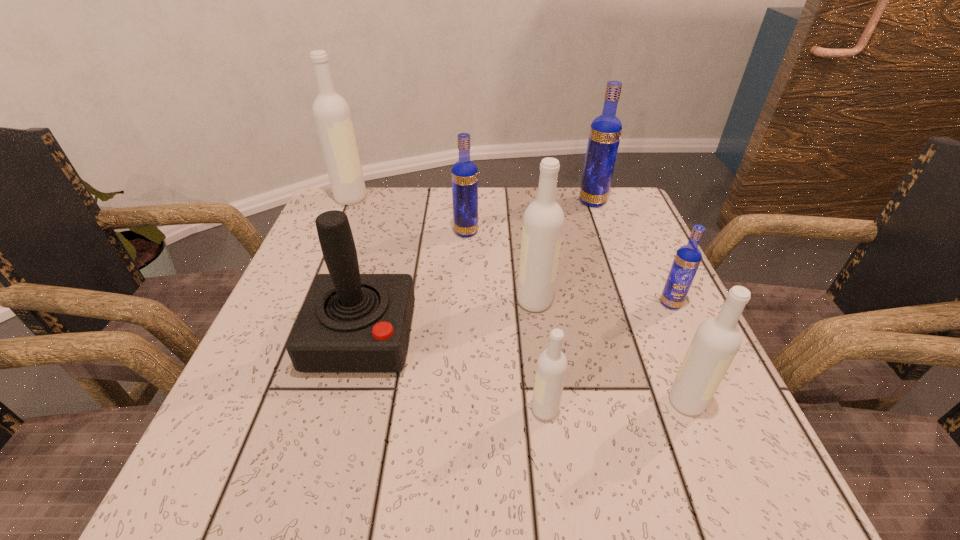
Where is `vodka located in the left edge section of the desktop`? The image size is (960, 540). vodka located in the left edge section of the desktop is located at coordinates (331, 113).

At what (x,y) coordinates should I click in order to perform the action: click on joystick that is at the left edge. Please return your answer as a coordinate pair (x, y). The width and height of the screenshot is (960, 540). Looking at the image, I should click on (350, 322).

You are a GUI agent. You are given a task and a screenshot of the screen. Output one action in this format:
    pyautogui.click(x=<x>, y=<y>)
    Task: Click on the object located in the far left corner section of the desktop
    The image size is (960, 540).
    Given the screenshot: What is the action you would take?
    pyautogui.click(x=331, y=113)

Locate an element on the screen. This screenshot has height=540, width=960. object that is at the far right corner is located at coordinates (605, 132).

This screenshot has height=540, width=960. I want to click on free space at the far edge of the desktop, so click(490, 221).

The width and height of the screenshot is (960, 540). In the image, there is a desktop. What are the coordinates of `vacant space at the left edge` in the screenshot? It's located at (285, 353).

This screenshot has width=960, height=540. I want to click on vacant space at the right edge of the desktop, so click(x=675, y=365).

Locate an element on the screen. free space at the far left corner of the desktop is located at coordinates (362, 204).

In the image, there is a desktop. What are the coordinates of `vacant space at the far right corner` in the screenshot? It's located at (626, 207).

The height and width of the screenshot is (540, 960). What are the coordinates of `free space between the smallest white vodka and the rightmost white vodka` in the screenshot? It's located at [615, 406].